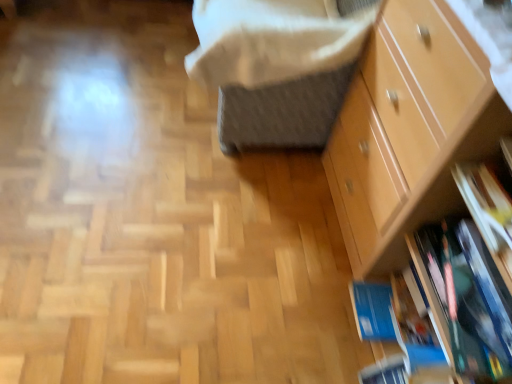
Question: From the image's perspective, is white soft blanket at upper center positioned above or below light brown wooden chest of drawers at right?

Choices:
 (A) above
 (B) below

Answer: (A)

Question: Is point (362, 21) closer or farther from the camera than point (386, 200)?

Choices:
 (A) farther
 (B) closer

Answer: (A)

Question: Estimate the real-world distances between objects in this image. Which object is farther from the white soft blanket at upper center?

Choices:
 (A) light brown wooden chest of drawers at right
 (B) blue matte book at lower right

Answer: (B)

Question: Which is farther from the light brown wooden chest of drawers at right?

Choices:
 (A) white soft blanket at upper center
 (B) blue matte book at lower right

Answer: (A)